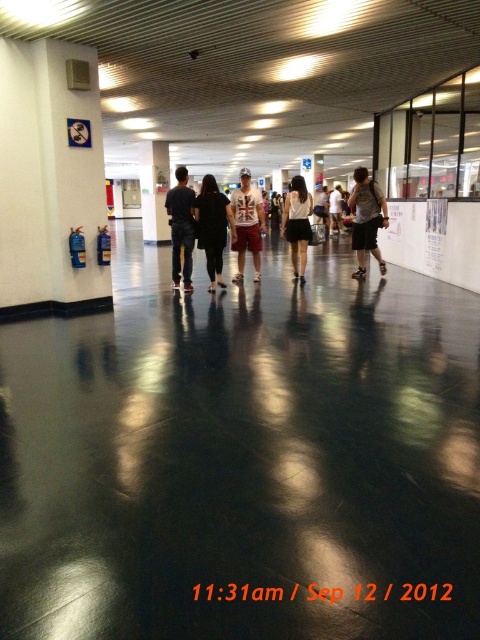
Can you confirm if matte white tank top at center is smaller than dark blue jeans at center?

Yes, matte white tank top at center is smaller than dark blue jeans at center.

Is point (240, 198) positioned in front of point (186, 276)?

No, it is not.

Is point (254, 212) farther from camera compared to point (182, 182)?

That is True.

Locate an element on the screen. matte white tank top at center is located at coordinates (247, 225).

Based on the photo, does matte black shorts at center have a greater width compared to black matte roller skate at center?

Yes.

Which is above, matte black shorts at center or black matte roller skate at center?

Positioned higher is matte black shorts at center.

Between point (336, 209) and point (363, 272), which one is positioned in front?

Positioned in front is point (363, 272).

Locate an element on the screen. matte black shorts at center is located at coordinates (336, 209).

Which is in front, point (356, 225) or point (300, 269)?

Point (356, 225) is more forward.

Image resolution: width=480 pixels, height=640 pixels. In order to click on matte black backpack at center in this screenshot , I will do `click(367, 218)`.

This screenshot has height=640, width=480. Find the location of `matte black backpack at center`. matte black backpack at center is located at coordinates (367, 218).